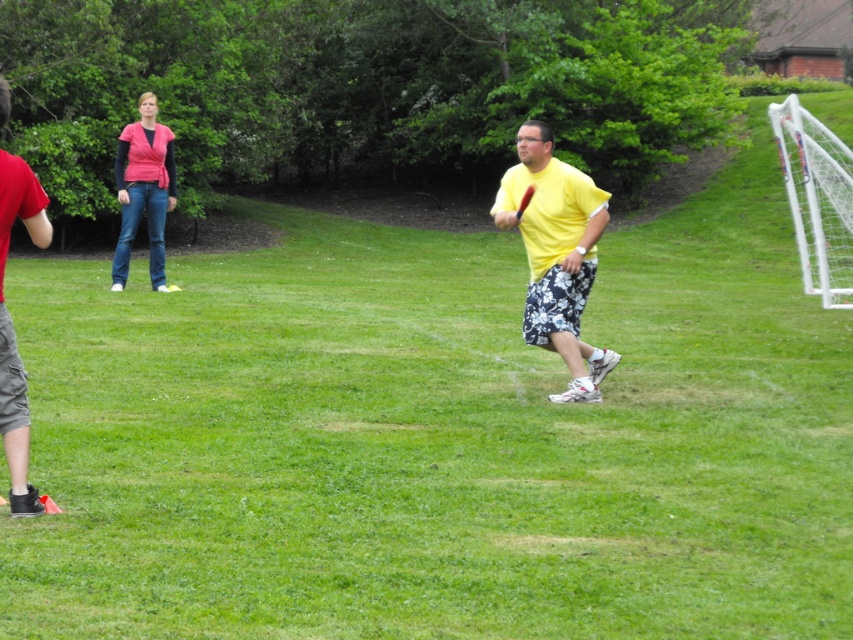
Question: Is yellow matte shirt at center thinner than matte pink shirt at upper left?

Choices:
 (A) no
 (B) yes

Answer: (B)

Question: Is yellow matte shirt at center bigger than matte pink shirt at upper left?

Choices:
 (A) yes
 (B) no

Answer: (B)

Question: Which object is closer to the camera taking this photo?

Choices:
 (A) red cotton shirt at left
 (B) yellow matte shirt at center

Answer: (A)

Question: Among these objects, which one is farthest from the camera?

Choices:
 (A) red cotton shirt at left
 (B) yellow matte shirt at center

Answer: (B)

Question: Observing the image, what is the correct spatial positioning of red cotton shirt at left in reference to matte pink shirt at upper left?

Choices:
 (A) left
 (B) right

Answer: (B)

Question: Which object is farther from the camera taking this photo?

Choices:
 (A) red cotton shirt at left
 (B) matte pink shirt at upper left
 (C) yellow matte shirt at center

Answer: (B)